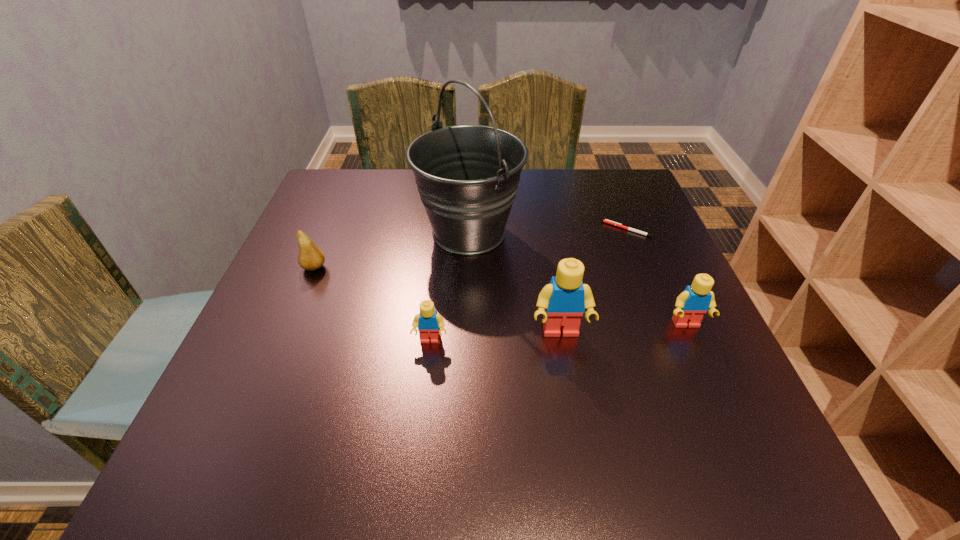
You are a GUI agent. You are given a task and a screenshot of the screen. Output one action in this format:
    pyautogui.click(x=<x>, y=<y>)
    Task: Click on the leftmost Lego
    This screenshot has width=960, height=540.
    Given the screenshot: What is the action you would take?
    pyautogui.click(x=428, y=322)

You are a GUI agent. You are given a task and a screenshot of the screen. Output one action in this format:
    pyautogui.click(x=<x>, y=<y>)
    Task: Click on the second tallest object
    The height and width of the screenshot is (540, 960).
    Given the screenshot: What is the action you would take?
    pyautogui.click(x=562, y=302)

Where is `the second Lego from left to right`? The height and width of the screenshot is (540, 960). the second Lego from left to right is located at coordinates (562, 302).

Where is `the second shortest Lego`? the second shortest Lego is located at coordinates (691, 305).

Where is `the rightmost Lego`? This screenshot has width=960, height=540. the rightmost Lego is located at coordinates (691, 305).

Where is `pen`? This screenshot has width=960, height=540. pen is located at coordinates (605, 221).

Where is `bucket`? bucket is located at coordinates (467, 176).

At what (x,y) coordinates should I click in order to perform the action: click on the leftmost object. Please return your answer as a coordinate pair (x, y). The image size is (960, 540). Looking at the image, I should click on (310, 257).

At what (x,y) coordinates should I click in order to perform the action: click on vacant space located 0.130m on the front-facing side of the leftmost Lego. Please return your answer as a coordinate pair (x, y). This screenshot has height=540, width=960. Looking at the image, I should click on (423, 410).

What are the coordinates of `free space located on the front-facing side of the second Lego from left to right` in the screenshot? It's located at (568, 376).